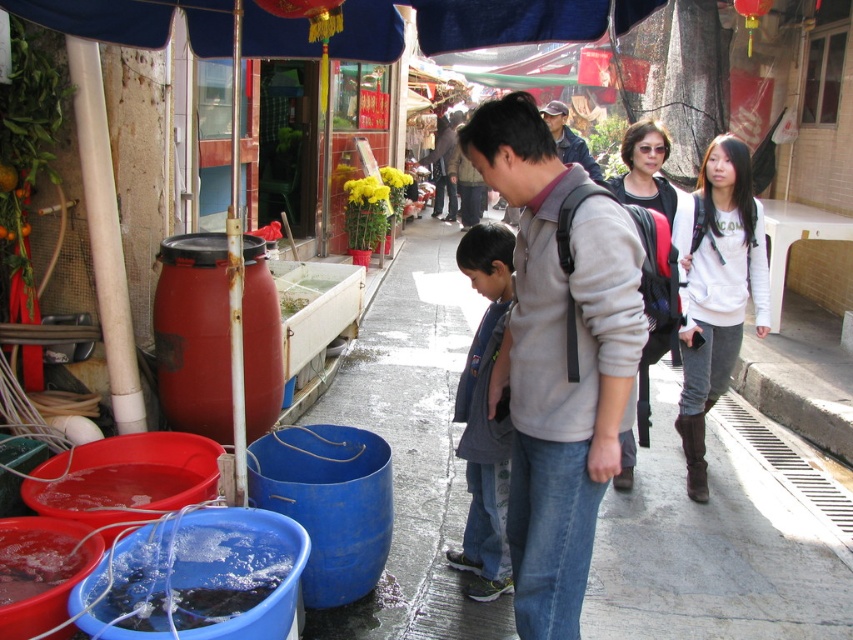
Question: Does smooth concrete sidewalk at center have a greater width compared to dark gray jacket at center?

Choices:
 (A) yes
 (B) no

Answer: (A)

Question: Which object appears farthest from the camera in this image?

Choices:
 (A) dark gray jacket at center
 (B) gray fleece jacket at center
 (C) smooth concrete sidewalk at center
 (D) denim jacket at center

Answer: (D)

Question: Estimate the real-world distances between objects in this image. Which object is closer to the denim jacket at center?

Choices:
 (A) smooth concrete sidewalk at center
 (B) gray fleece jacket at center

Answer: (A)

Question: Estimate the real-world distances between objects in this image. Which object is closer to the smooth concrete sidewalk at center?

Choices:
 (A) denim jacket at center
 (B) gray fleece jacket at center

Answer: (B)

Question: Can you confirm if smooth concrete sidewalk at center is positioned to the left of gray fleece jacket at center?

Choices:
 (A) no
 (B) yes

Answer: (B)

Question: Is smooth concrete sidewalk at center bigger than denim jacket at center?

Choices:
 (A) no
 (B) yes

Answer: (A)